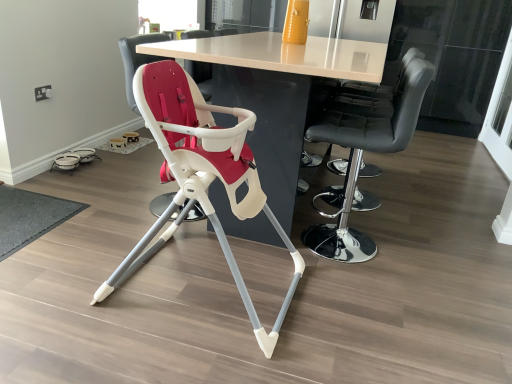
Locate an element on the screen. The height and width of the screenshot is (384, 512). free space in front of matte plastic highchair at center, positioned as the 2th chair in right-to-left order is located at coordinates (172, 356).